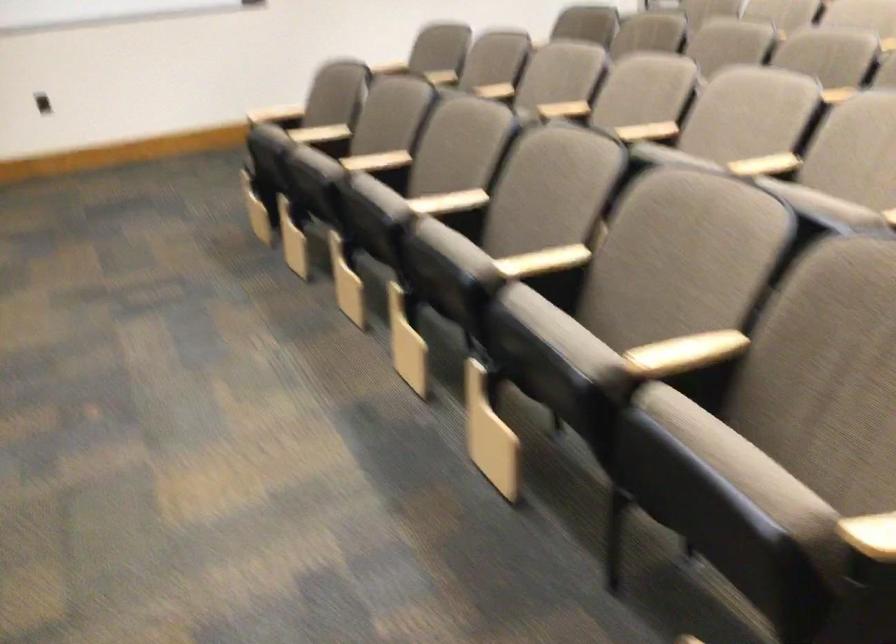
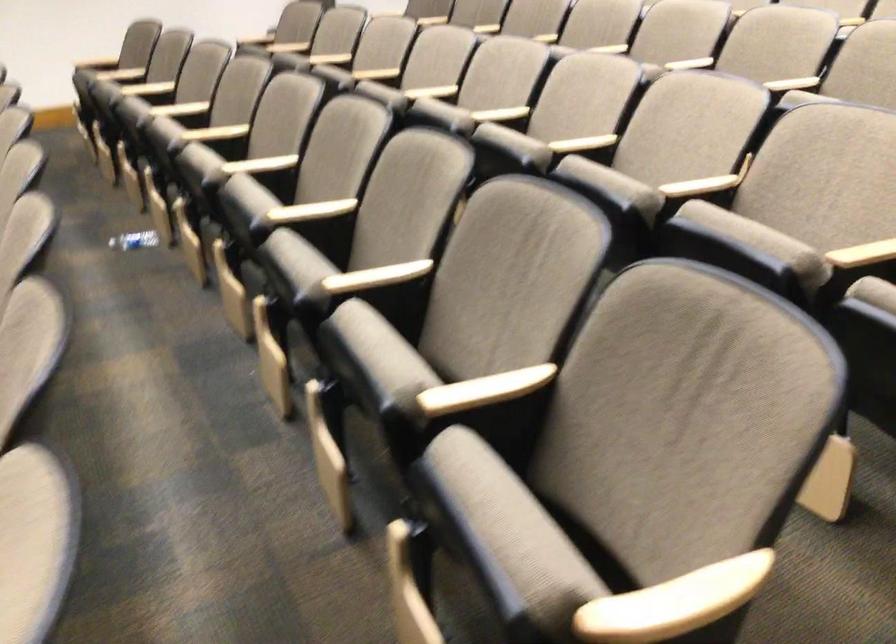
Question: The images are taken continuously from a first-person perspective. In which direction are you moving?

Choices:
 (A) Left
 (B) Right
 (C) Forward
 (D) Backward

Answer: (B)